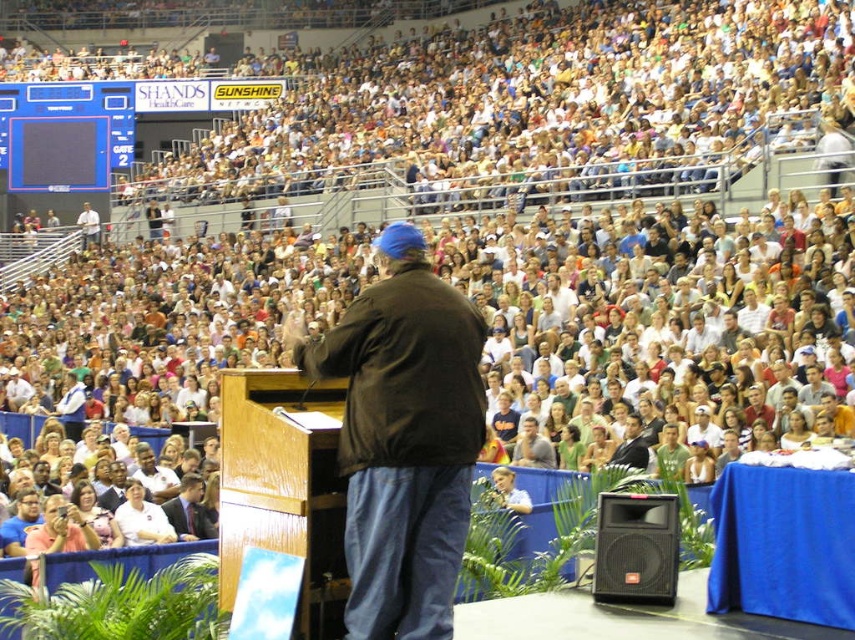
Question: Which point is closer to the camera?

Choices:
 (A) (131, 545)
 (B) (612, 500)

Answer: (B)

Question: In this image, where is black plastic speaker at lower right located relative to white shirt at lower left?

Choices:
 (A) above
 (B) below

Answer: (A)

Question: Which object is closer to the camera taking this photo?

Choices:
 (A) dark brown leather jacket at center
 (B) black plastic speaker at lower right
 (C) white shirt at lower left

Answer: (A)

Question: Does dark brown leather jacket at center appear on the right side of white shirt at lower left?

Choices:
 (A) yes
 (B) no

Answer: (A)

Question: Can you confirm if dark brown leather jacket at center is positioned below white shirt at lower left?

Choices:
 (A) yes
 (B) no

Answer: (B)

Question: Among these points, which one is farthest from the camera?

Choices:
 (A) (417, 289)
 (B) (127, 528)
 (C) (643, 544)

Answer: (B)